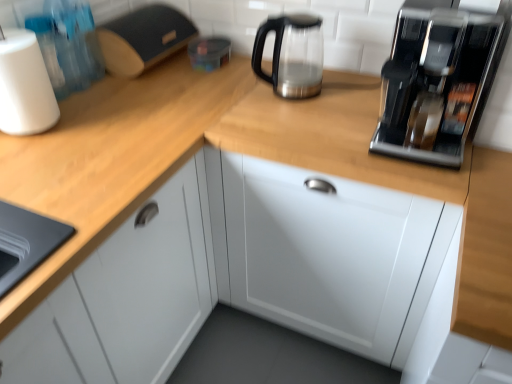
Locate an element on the screen. The height and width of the screenshot is (384, 512). vacant space in front of matte black bread bin at upper left is located at coordinates (151, 82).